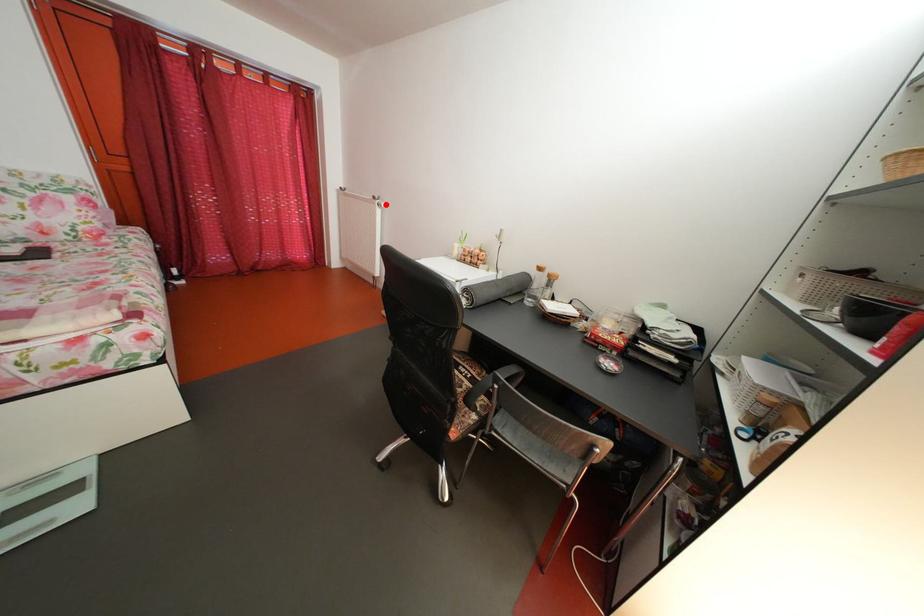
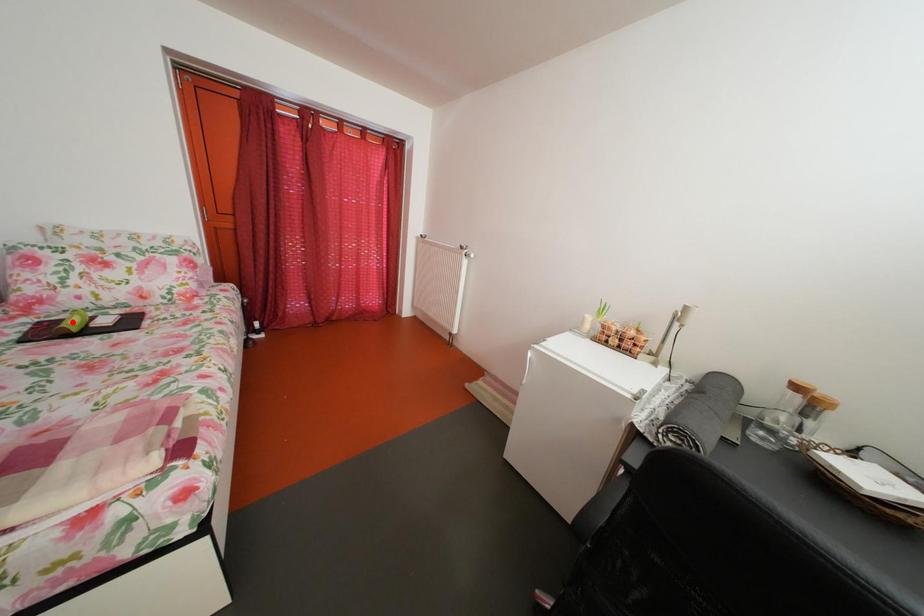
I am providing you with two images of the same scene from different viewpoints. A red point is marked on the first image and another point is marked on the second image. Do the highlighted points in image1 and image2 indicate the same real-world spot?

No